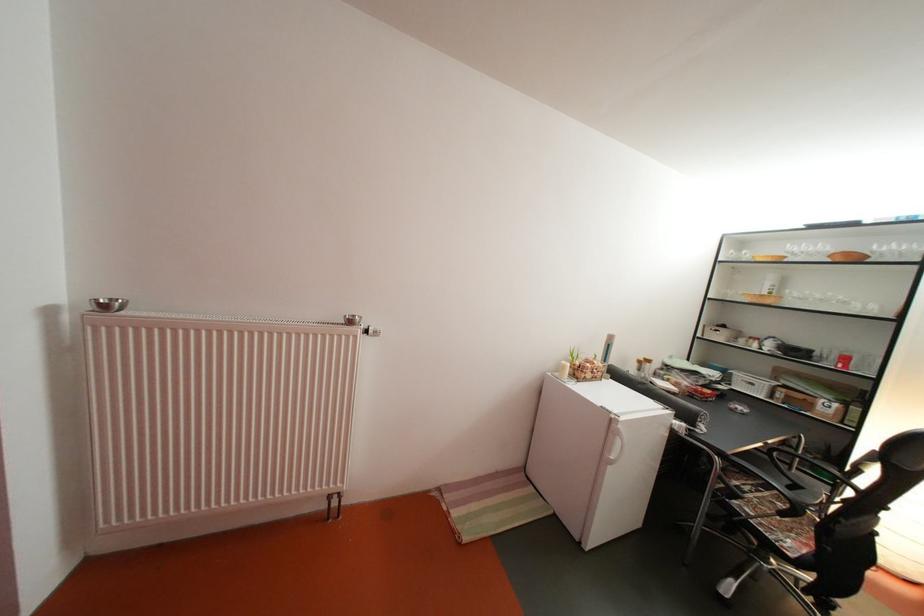
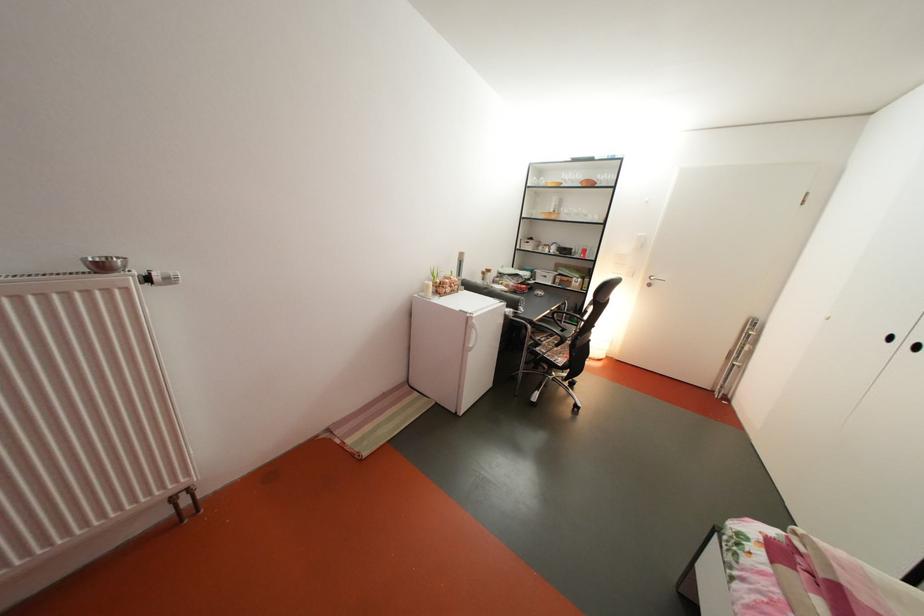
Locate, in the second image, the point that corresponds to (857,260) in the first image.

(600, 187)